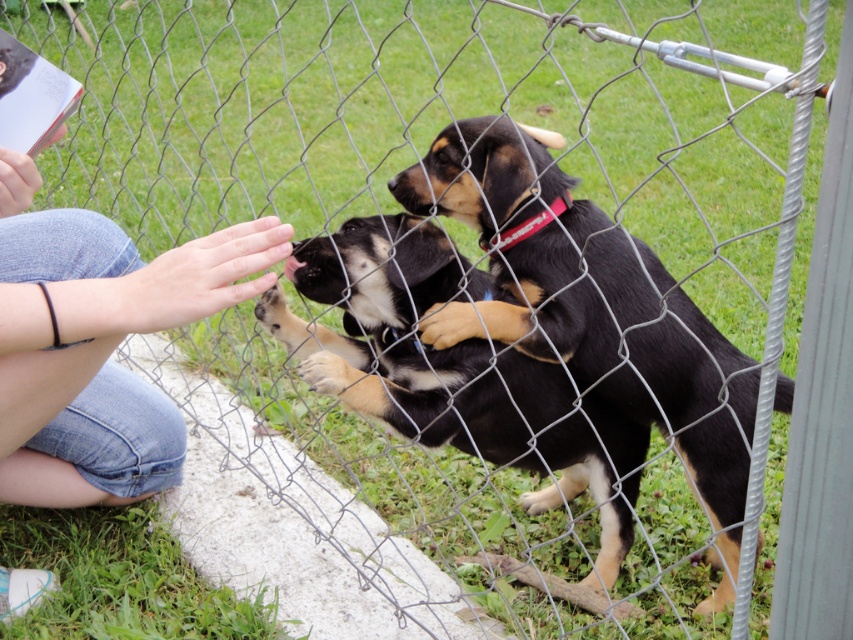
Between black fur puppy at center and black fur dog at center, which one has less height?

Standing shorter between the two is black fur dog at center.

Is the position of black fur puppy at center more distant than that of black fur dog at center?

No, it is in front of black fur dog at center.

In order to click on black fur puppy at center in this screenshot , I will do `click(587, 300)`.

What do you see at coordinates (587, 300) in the screenshot? Image resolution: width=853 pixels, height=640 pixels. I see `black fur puppy at center` at bounding box center [587, 300].

Is black fur puppy at center positioned in front of black smooth nose at center?

Yes, black fur puppy at center is in front of black smooth nose at center.

Is point (686, 467) more distant than point (396, 186)?

Yes, it is.

Find the location of a particular element. black fur puppy at center is located at coordinates (587, 300).

Does jeans at left come behind black fur dog at center?

No, jeans at left is in front of black fur dog at center.

Who is shorter, jeans at left or black fur dog at center?

black fur dog at center

Is point (103, 449) closer to viewer compared to point (427, 376)?

That is False.

Identify the location of jeans at left. (97, 342).